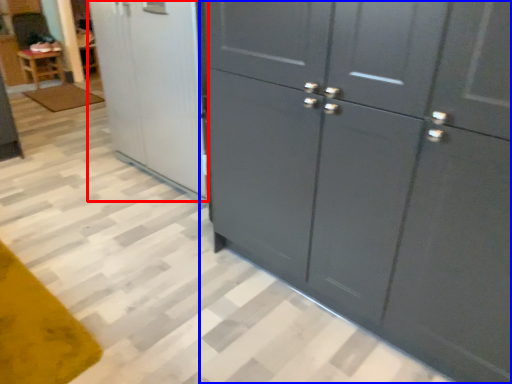
Question: Which point is closer to the camera, screen door (highlighted by a red box) or cupboard (highlighted by a blue box)?

Choices:
 (A) screen door
 (B) cupboard

Answer: (B)